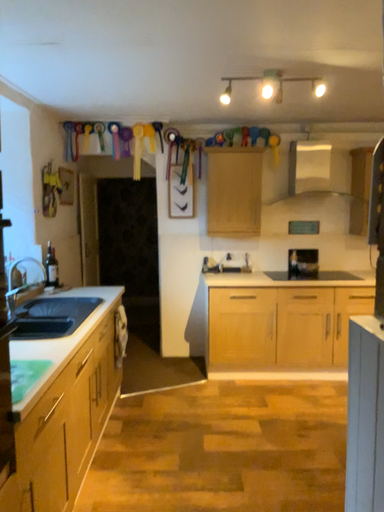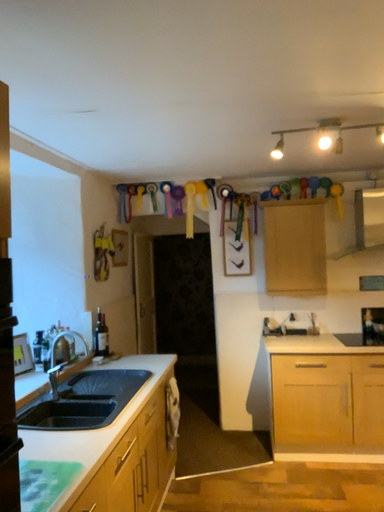
Question: How did the camera likely rotate when shooting the video?

Choices:
 (A) rotated downward
 (B) rotated upward

Answer: (B)